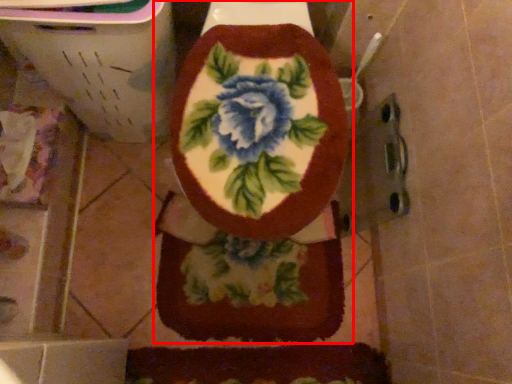
Question: Observing the image, what is the correct spatial positioning of toilet (annotated by the red box) in reference to blanket?

Choices:
 (A) right
 (B) left

Answer: (B)